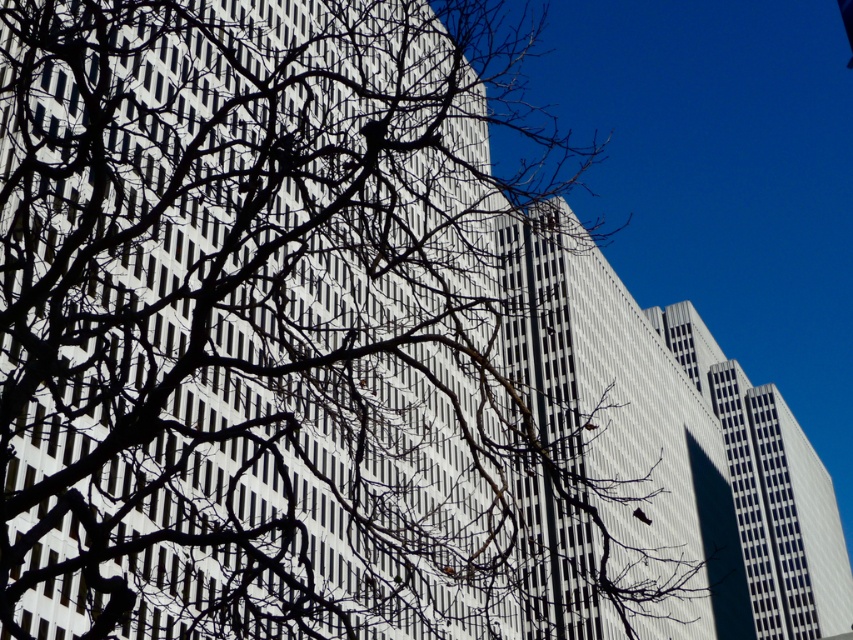
You are an architect designing a new park and want to ensure that the new tree you plant will not block the view of the white smooth building at center and the white glass building at center from the main pathway. Based on the image, which of the two buildings is narrower and thus less likely to be obstructed by the tree?

The white smooth building at center is thinner than the white glass building at center, so it is narrower and less likely to be obstructed by the tree.

Based on the scene described, which building is positioned to the left when observing the white smooth building at center and the white glass building at center?

The white smooth building at center is positioned to the left of the white glass building at center.

You are an architect analyzing the city skyline. You observe the white smooth building at center and the white glass building at center. Which one appears taller in the image?

The white glass building at center appears taller than the white smooth building at center according to the description.